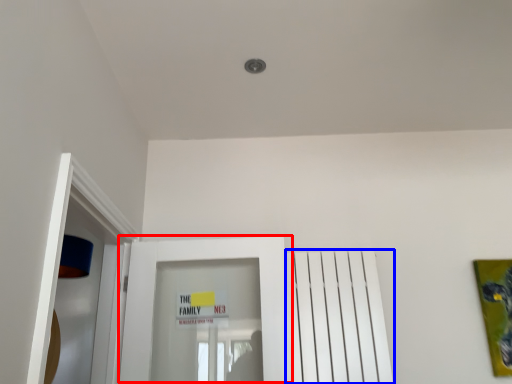
Question: Which point is closer to the camera, door (highlighted by a red box) or radiator (highlighted by a blue box)?

Choices:
 (A) door
 (B) radiator

Answer: (A)